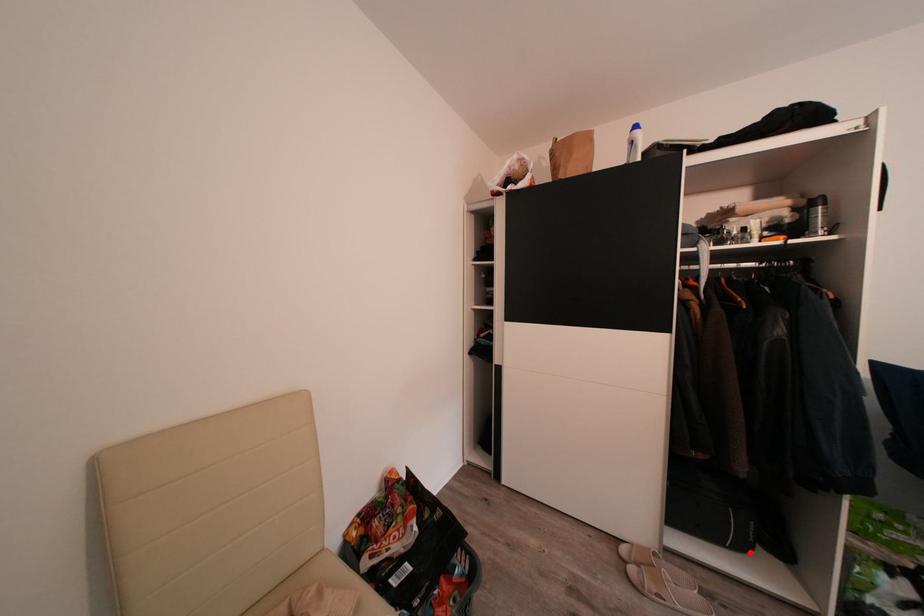
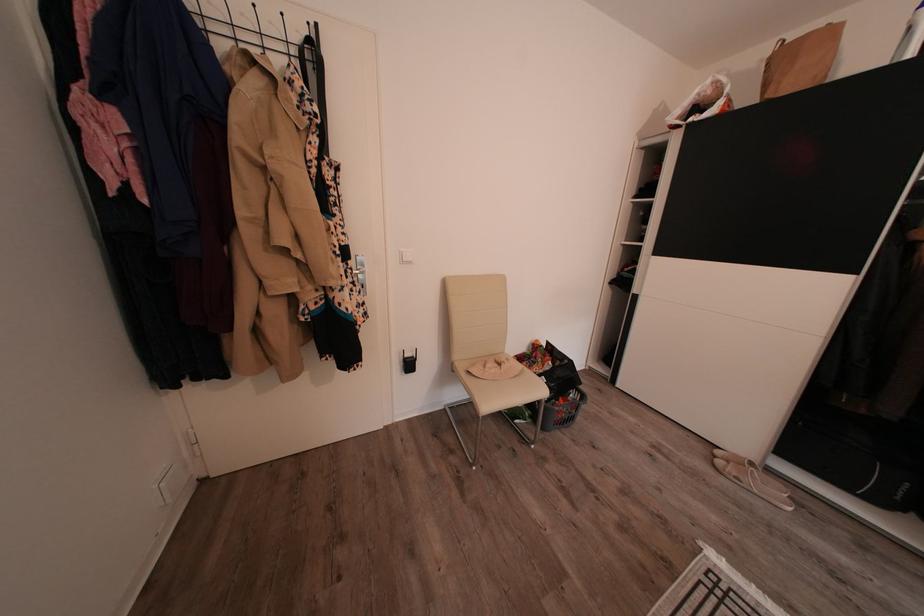
Question: I am providing you with two images of the same scene from different viewpoints. A red point is shown in image1. For the corresponding object point in image2, is it positioned nearer or farther from the camera?

Choices:
 (A) Nearer
 (B) Farther

Answer: (B)